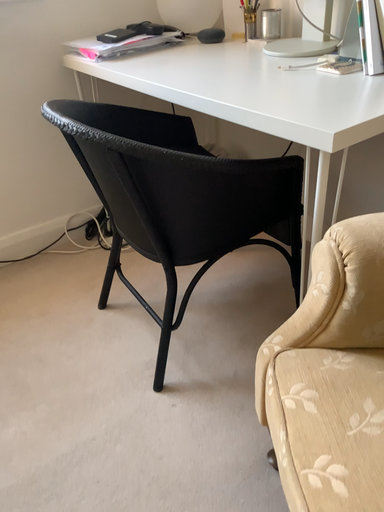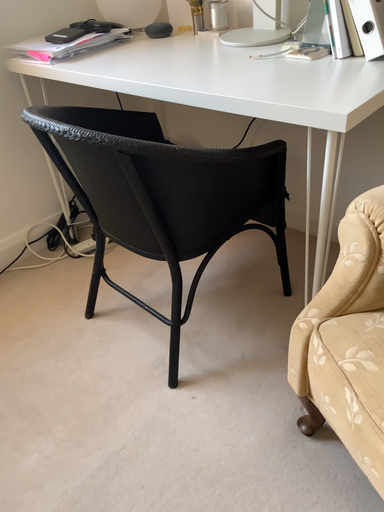
Question: How did the camera likely rotate when shooting the video?

Choices:
 (A) rotated left
 (B) rotated right

Answer: (B)